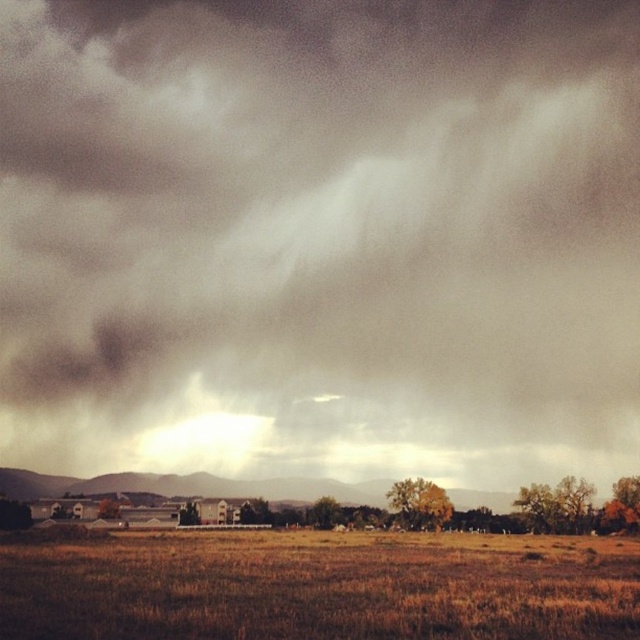
You are standing in the open field with the brown dry grass at lower center under your feet. Looking up, you see the dark gray cloud at upper center. Can you determine if the cloud is above or below the grass?

The dark gray cloud at upper center is above the brown dry grass at lower center.